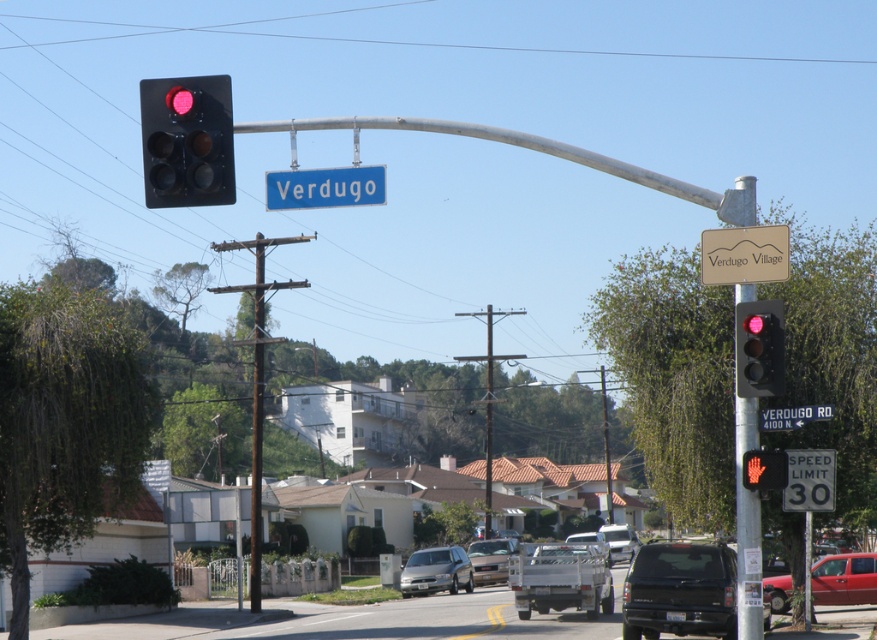
You are a delivery driver approaching the intersection and need to check both the matte black traffic light at right and the white plastic street sign at upper center. Which one appears larger to you?

The matte black traffic light at right appears larger than the white plastic street sign at upper center because it is bigger in size.

You are standing at the intersection and want to know which of the two points, point (436, 572) or point (604, 380), is closer to you. Based on the scene, can you determine this?

Point (436, 572) is closer to the viewer than point (604, 380).

You are a delivery driver approaching the intersection and need to know which object is higher in the scene. Can you tell me if the matte black traffic light at right is higher than the white plastic street sign at upper center?

The matte black traffic light at right is above the white plastic street sign at upper center, so yes, it is higher.